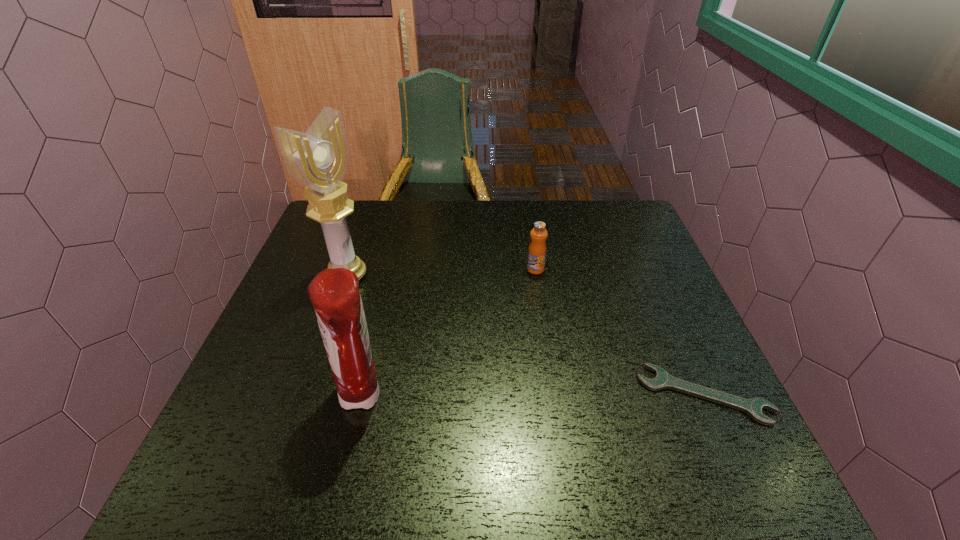
This screenshot has width=960, height=540. What are the coordinates of `object that is positioned at the near right corner` in the screenshot? It's located at (753, 407).

The width and height of the screenshot is (960, 540). I want to click on free space at the far edge of the desktop, so click(x=549, y=232).

The height and width of the screenshot is (540, 960). In order to click on free space at the near edge of the desktop in this screenshot , I will do `click(502, 403)`.

You are a GUI agent. You are given a task and a screenshot of the screen. Output one action in this format:
    pyautogui.click(x=<x>, y=<y>)
    Task: Click on the blank space at the left edge of the desktop
    This screenshot has width=960, height=540.
    Given the screenshot: What is the action you would take?
    pyautogui.click(x=281, y=309)

Identify the location of blank space at the right edge. (651, 400).

At what (x,y) coordinates should I click in order to perform the action: click on free location at the far left corner. Please return your answer as a coordinate pair (x, y). The image size is (960, 540). Looking at the image, I should click on (367, 234).

This screenshot has width=960, height=540. In the image, there is a desktop. In order to click on blank space at the far right corner in this screenshot , I will do `click(596, 212)`.

The height and width of the screenshot is (540, 960). In the image, there is a desktop. Identify the location of vacant space at the near right corner. (690, 429).

At what (x,y) coordinates should I click in order to perform the action: click on vacant area between the third tallest object and the second object from left to right. Please return your answer as a coordinate pair (x, y). Looking at the image, I should click on (449, 333).

The height and width of the screenshot is (540, 960). Identify the location of free space that is in between the condiment and the shortest object. (533, 395).